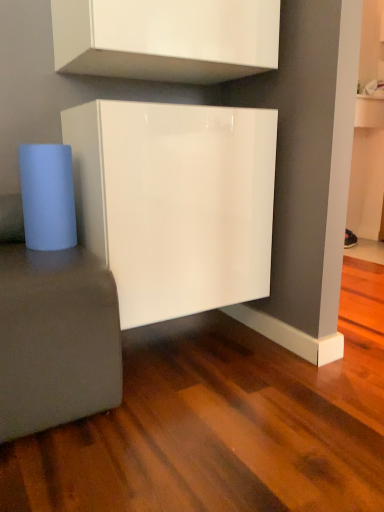
Question: From their relative heights in the image, would you say glossy white cabinet at center, which is the 1th cabinetry from bottom to top, is taller or shorter than glossy white cabinet at upper center, which appears as the 2th cabinetry when ordered from the bottom?

Choices:
 (A) tall
 (B) short

Answer: (A)

Question: Looking at their shapes, would you say glossy white cabinet at center, which is the 1th cabinetry from bottom to top, is wider or thinner than glossy white cabinet at upper center, which appears as the 2th cabinetry when ordered from the bottom?

Choices:
 (A) wide
 (B) thin

Answer: (A)

Question: Which object is the farthest from the matte gray side table at lower left?

Choices:
 (A) glossy white cabinet at center, the second cabinetry in the top-to-bottom sequence
 (B) glossy white cabinet at upper center, which appears as the first cabinetry when viewed from the top

Answer: (B)

Question: Which is farther from the glossy white cabinet at center, which is the 1th cabinetry from bottom to top?

Choices:
 (A) matte gray side table at lower left
 (B) glossy white cabinet at upper center, which appears as the 2th cabinetry when ordered from the bottom

Answer: (B)